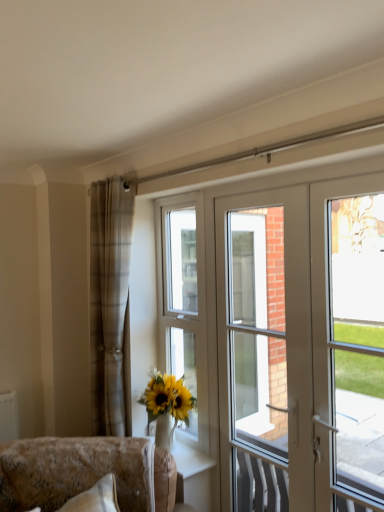
Question: From the image's perspective, is white glossy door at center under clear glass door at right?

Choices:
 (A) no
 (B) yes

Answer: (B)

Question: Can you confirm if white glossy door at center is wider than clear glass door at right?

Choices:
 (A) no
 (B) yes

Answer: (B)

Question: Can you confirm if white glossy door at center is taller than clear glass door at right?

Choices:
 (A) no
 (B) yes

Answer: (B)

Question: From a real-world perspective, is white glossy door at center positioned over clear glass door at right based on gravity?

Choices:
 (A) no
 (B) yes

Answer: (A)

Question: Is white glossy door at center surrounding clear glass door at right?

Choices:
 (A) yes
 (B) no

Answer: (B)

Question: Does white glossy door at center have a larger size compared to clear glass door at right?

Choices:
 (A) no
 (B) yes

Answer: (B)

Question: Are plaid fabric curtain at left and white glossy door at center making contact?

Choices:
 (A) yes
 (B) no

Answer: (B)

Question: Is plaid fabric curtain at left positioned beyond the bounds of white glossy door at center?

Choices:
 (A) yes
 (B) no

Answer: (A)

Question: Is plaid fabric curtain at left to the right of white glossy door at center from the viewer's perspective?

Choices:
 (A) yes
 (B) no

Answer: (B)

Question: Does plaid fabric curtain at left appear on the left side of white glossy door at center?

Choices:
 (A) no
 (B) yes

Answer: (B)

Question: Does plaid fabric curtain at left have a smaller size compared to white glossy door at center?

Choices:
 (A) no
 (B) yes

Answer: (B)

Question: Can you confirm if plaid fabric curtain at left is thinner than white glossy door at center?

Choices:
 (A) no
 (B) yes

Answer: (B)

Question: From a real-world perspective, is white glossy door at center located higher than white glossy door at right?

Choices:
 (A) yes
 (B) no

Answer: (B)